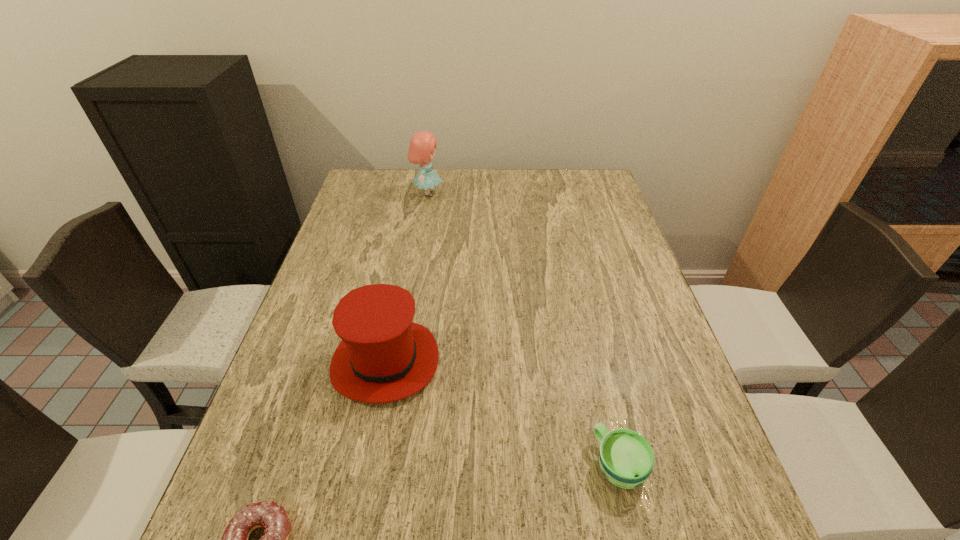
Find the location of a particular element. the farthest object is located at coordinates (421, 150).

The width and height of the screenshot is (960, 540). Find the location of `doll`. doll is located at coordinates (421, 150).

Where is `hat`? This screenshot has width=960, height=540. hat is located at coordinates (383, 357).

I want to click on the second tallest object, so click(383, 357).

Identify the location of the rightmost object. (626, 458).

Image resolution: width=960 pixels, height=540 pixels. I want to click on the second shortest object, so click(626, 458).

In order to click on vacant area situated 0.210m on the front-facing side of the tallest object in this screenshot , I will do `click(504, 194)`.

The image size is (960, 540). I want to click on free space located 0.390m on the right of the hat, so click(612, 362).

I want to click on free space located 0.290m on the back of the rightmost object, so click(x=586, y=326).

Find the location of a particular element. This screenshot has height=540, width=960. object present at the far edge is located at coordinates (421, 150).